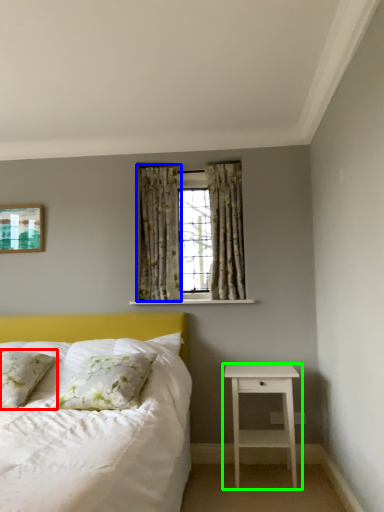
Question: Estimate the real-world distances between objects in this image. Which object is farther from pillow (highlighted by a red box), curtain (highlighted by a blue box) or nightstand (highlighted by a green box)?

Choices:
 (A) curtain
 (B) nightstand

Answer: (B)